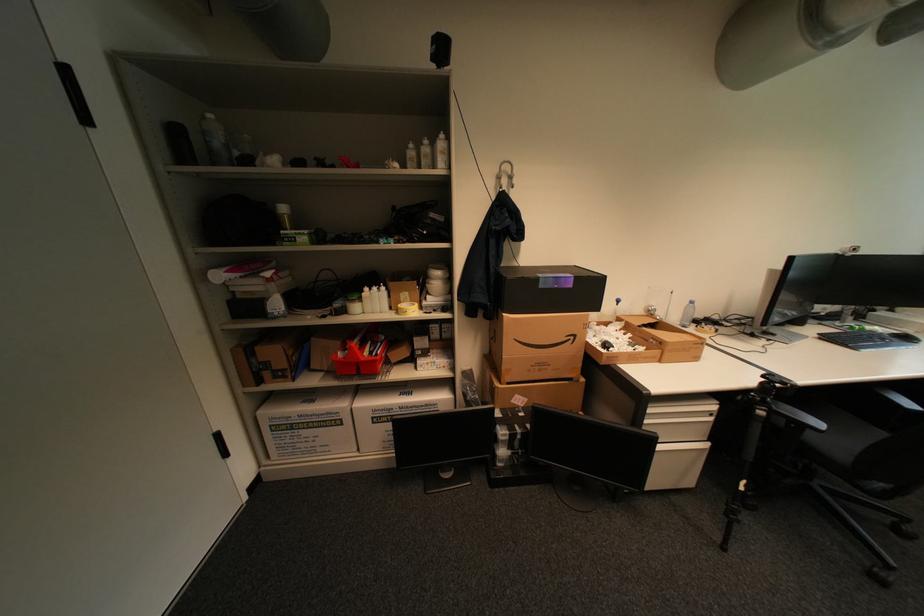
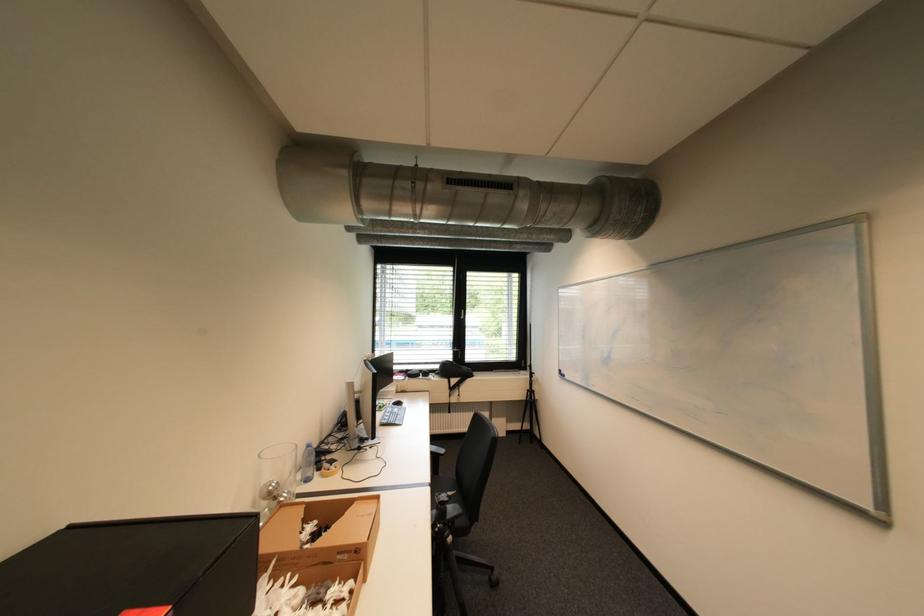
Question: I am providing you with two images of the same scene from different viewpoints. Which of the following objects are not visible in image2?

Choices:
 (A) chair sitting surface
 (B) computer mouse
 (C) glass jar
 (D) none of these

Answer: (D)